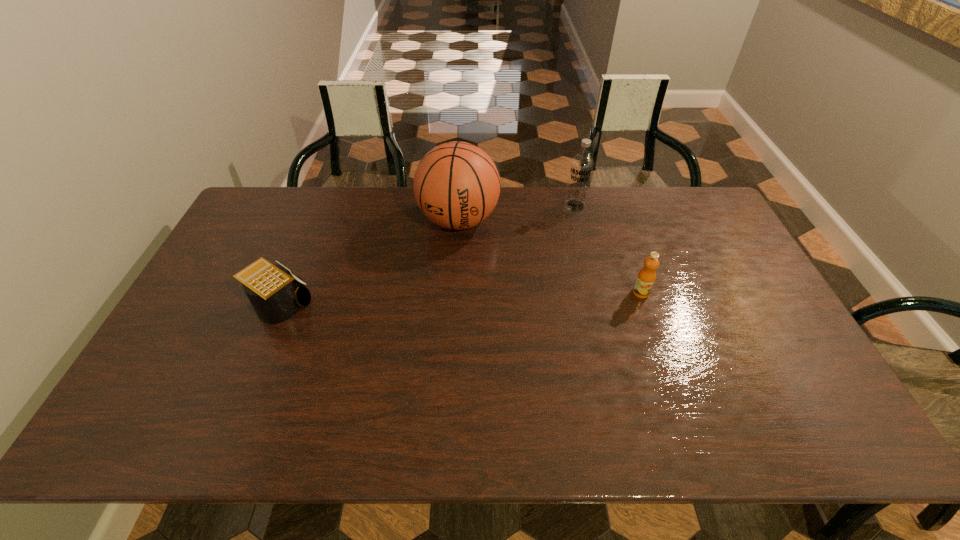
The width and height of the screenshot is (960, 540). Find the location of `free space between the orange juice and the shortest object`. free space between the orange juice and the shortest object is located at coordinates (461, 299).

Where is `free point between the basketball and the vodka`? free point between the basketball and the vodka is located at coordinates (516, 213).

This screenshot has height=540, width=960. I want to click on free space that is in between the second object from left to right and the calculator, so click(370, 262).

Identify the location of object that can be found as the second closest to the vodka. The height and width of the screenshot is (540, 960). (646, 277).

This screenshot has width=960, height=540. Identify the location of object that is the third nearest to the calculator. (646, 277).